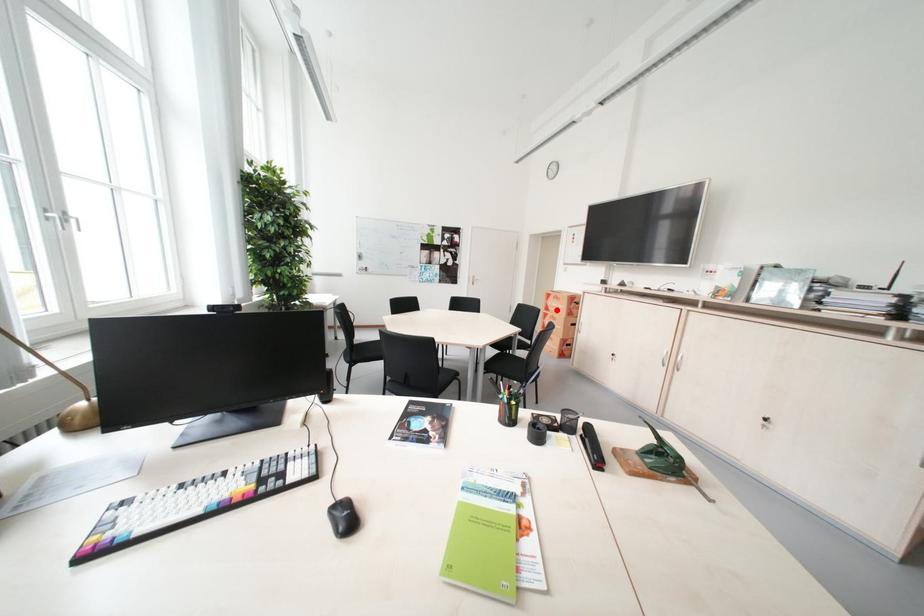
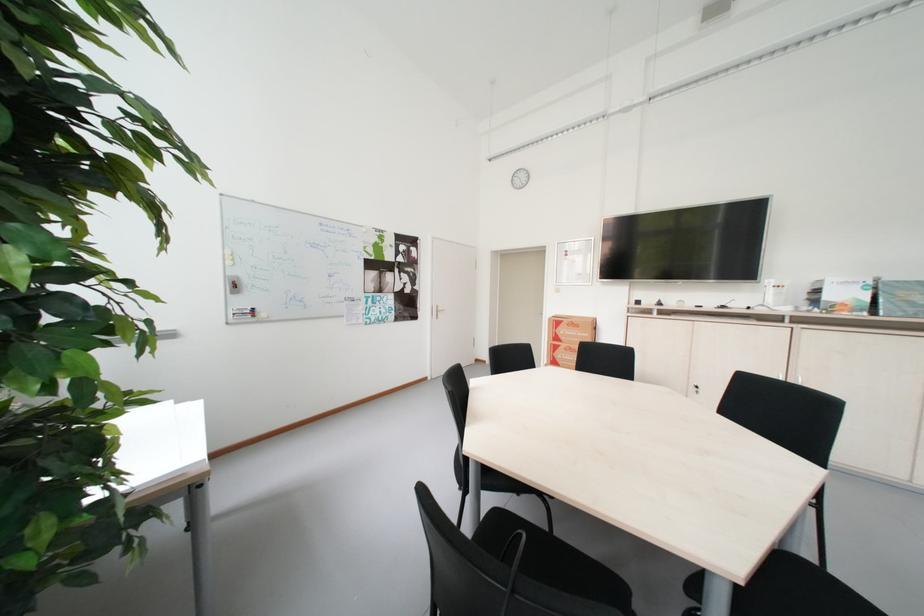
Question: I am providing you with two images of the same scene from different viewpoints. A red point is shown in image1. For the corresponding object point in image2, is it positioned nearer or farther from the camera?

Choices:
 (A) Nearer
 (B) Farther

Answer: (A)